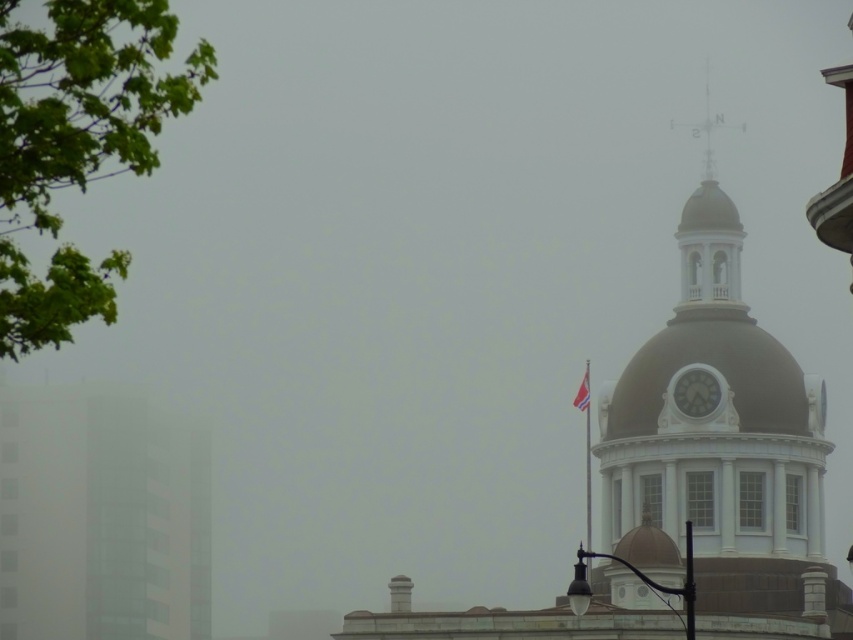
Question: Among these points, which one is nearest to the camera?

Choices:
 (A) (735, 232)
 (B) (683, 404)
 (C) (579, 403)

Answer: (B)

Question: Which point is farther to the camera?

Choices:
 (A) coord(577,396)
 (B) coord(682,401)

Answer: (A)

Question: Does white stone clock tower at upper right appear over white fabric flag at upper center?

Choices:
 (A) no
 (B) yes

Answer: (B)

Question: Which of the following is the closest to the observer?

Choices:
 (A) (775, 508)
 (B) (714, 378)

Answer: (A)

Question: Is white stone clock tower at upper right thinner than white glossy clock at upper right?

Choices:
 (A) yes
 (B) no

Answer: (B)

Question: Does white glossy clock at upper right lie behind white fabric flag at upper center?

Choices:
 (A) yes
 (B) no

Answer: (B)